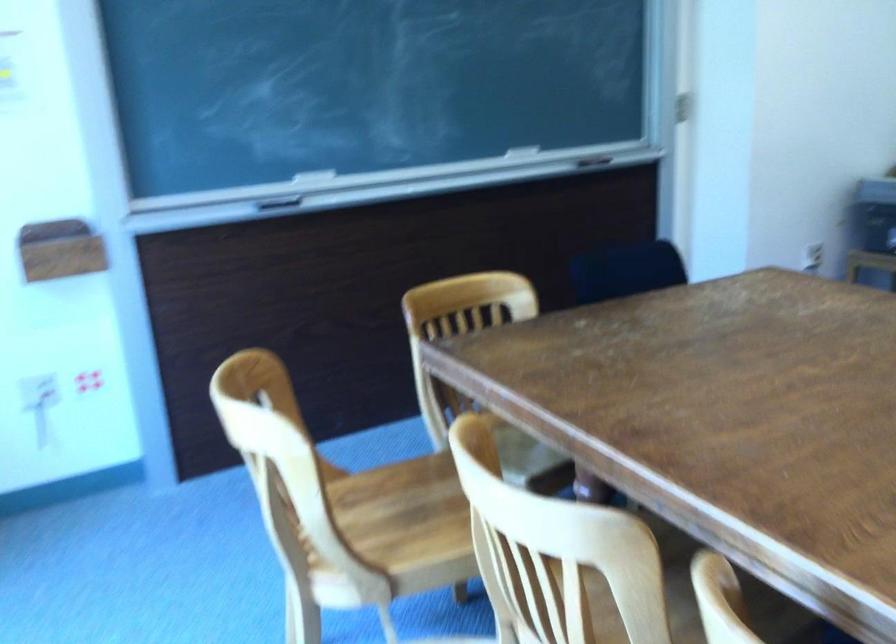
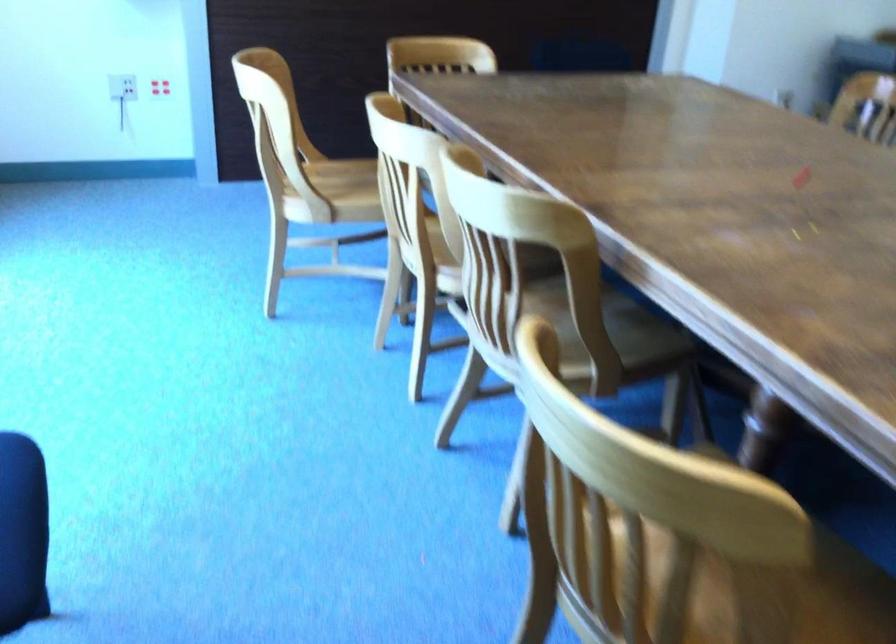
In the second image, find the point that corresponds to [90,389] in the first image.

(159, 87)